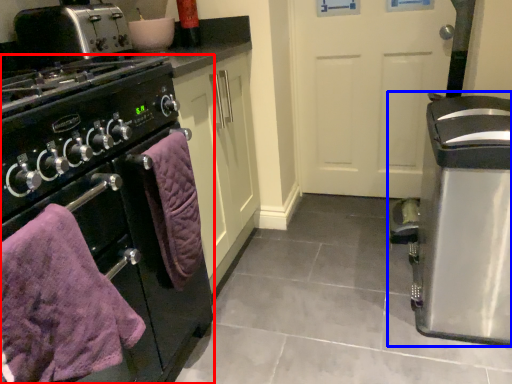
Question: Among these objects, which one is nearest to the camera, home appliance (highlighted by a red box) or kitchen appliance (highlighted by a blue box)?

Choices:
 (A) home appliance
 (B) kitchen appliance

Answer: (A)